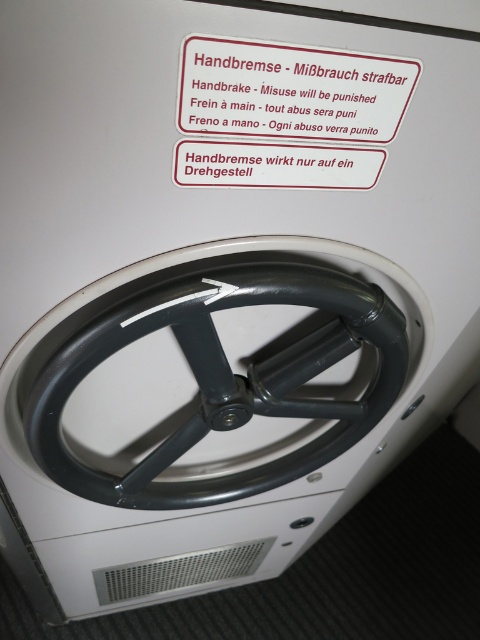
You are a mechanic working on a car. You need to replace a part that is 55 centimeters away from the point at point (317, 125). Is the distance sufficient for the replacement?

The distance between them is 54.64 centimeters, which is just under 55 centimeters. The replacement part may fit, but there is a slight shortage in the required space. Consider checking specifications for tolerance allowances.

What is the 2D coordinate of the black matte steering wheel at center?

The 2D coordinate of the black matte steering wheel at center is at point (226, 378).

What is the position of the point labeled as point (286, 113) in relation to the handbrake mechanism?

The point labeled as point (286, 113) is located on the white plastic sign at upper center, which is above the handbrake mechanism.